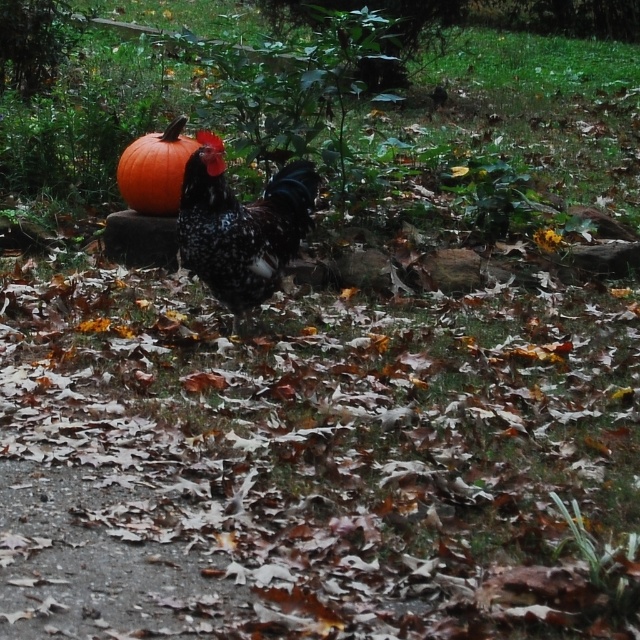
Between speckled feathered rooster at center and orange matte pumpkin at upper left, which one is positioned lower?

speckled feathered rooster at center is below.

Who is more forward, (292,214) or (164,154)?

Point (292,214) is in front.

Is point (237, 323) closer to camera compared to point (163, 216)?

Yes, it is in front of point (163, 216).

Where is `speckled feathered rooster at center`? speckled feathered rooster at center is located at coordinates (241, 227).